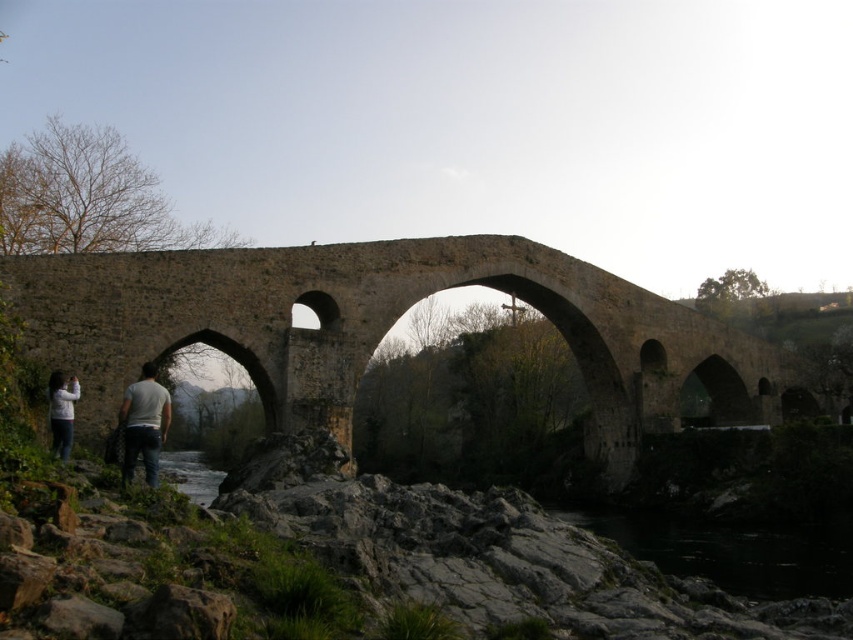
You are standing on the riverbank and want to take a photo of the stone arch bridge at center. The white cotton shirt at lower left is in your way. Can you move closer to the bridge without moving the shirt?

The stone arch bridge at center is further to the viewer than the white cotton shirt at lower left, so moving closer to the bridge would require moving past the shirt, which is closer to you. Therefore, you cannot move closer to the bridge without moving the white cotton shirt at lower left.

You are standing at the point labeled point (613, 412) and want to take a photo of the historic stone bridge. The camera you have can focus on objects up to 100 meters away. Will the camera be able to capture a clear image of the bridge?

The distance of point (613, 412) from camera is 100.68 meters, which is slightly beyond the camera focus range of 100 meters. Therefore, the camera may not be able to capture a clear image of the bridge.